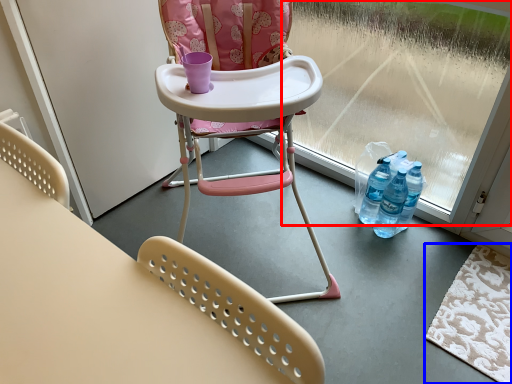
Question: Which point is closer to the camera, window screen (highlighted by a red box) or mat (highlighted by a blue box)?

Choices:
 (A) window screen
 (B) mat

Answer: (A)